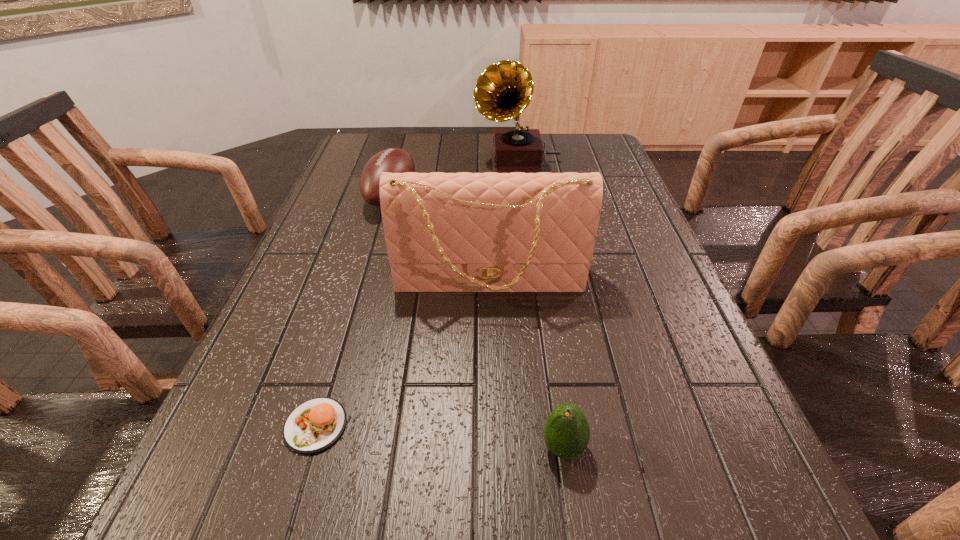
Where is `empty location between the farthest object and the shortest object`? The height and width of the screenshot is (540, 960). empty location between the farthest object and the shortest object is located at coordinates (417, 293).

You are a GUI agent. You are given a task and a screenshot of the screen. Output one action in this format:
    pyautogui.click(x=<x>, y=<y>)
    Task: Click on the free space between the third tallest object and the second shortest object
    This screenshot has height=540, width=960.
    Given the screenshot: What is the action you would take?
    pyautogui.click(x=477, y=322)

Locate an element on the screen. unoccupied position between the avocado and the phonograph record is located at coordinates (540, 305).

This screenshot has height=540, width=960. I want to click on empty location between the patty and the football (American), so click(x=353, y=312).

Find the location of a particular element. free space between the third farthest object and the patty is located at coordinates 402,354.

Where is `unoccupied area between the shortest object and the fourth nearest object`? This screenshot has width=960, height=540. unoccupied area between the shortest object and the fourth nearest object is located at coordinates (353, 312).

The height and width of the screenshot is (540, 960). Identify the location of free area in between the avocado and the farthest object. (540, 305).

Image resolution: width=960 pixels, height=540 pixels. What are the coordinates of `free space between the phonograph record and the shortest object` in the screenshot? It's located at (417, 293).

Locate an element on the screen. the second closest object relative to the fourth tallest object is located at coordinates (313, 426).

Identify which object is the second nearest to the second farthest object. Please provide its 2D coordinates. Your answer should be formatted as a tuple, i.e. [(x, y)], where the tuple contains the x and y coordinates of a point satisfying the conditions above.

[(504, 90)]